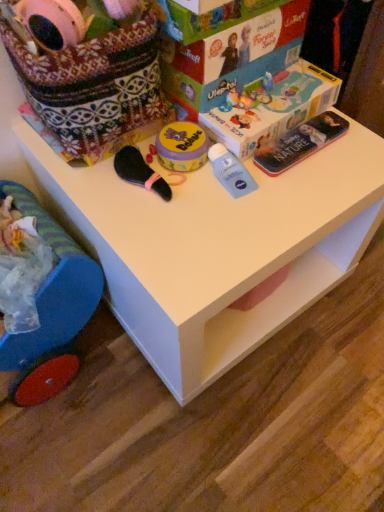
You are a GUI agent. You are given a task and a screenshot of the screen. Output one action in this format:
    pyautogui.click(x=<x>, y=<y>)
    Task: Click on the vacant space in front of white plastic table at center
    
    Given the screenshot: What is the action you would take?
    pyautogui.click(x=219, y=435)